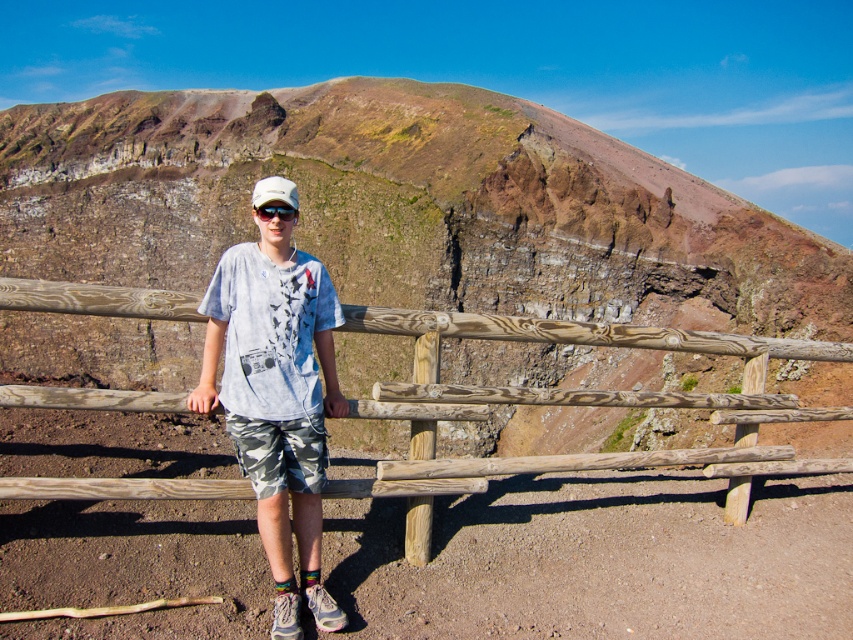
You are a photographer planning to capture a landscape photo. You notice the brown rocky mountain at center and the white cotton shirt at center in the frame. Which object should you focus on first if you want to ensure the taller one is in sharp focus?

The brown rocky mountain at center is taller than the white cotton shirt at center, so you should focus on the brown rocky mountain at center first to ensure it is in sharp focus.

You are a photographer trying to capture a closeup of the white matte baseball hat at center. However, the wooden fence at center is blocking your view. Can you determine which object is smaller in size to know if moving closer would help?

The wooden fence at center occupies less space than the white matte baseball hat at center. Moving closer might help as the wooden fence at center is smaller, so it might not fully block the view once you get nearer.

You are standing at the center of the image. Which direction should you move to get closer to the wooden fence at center?

Since the wooden fence at center is located at point coordinates of (602,344), you should move forward to get closer to it as you are already at the center of the image.